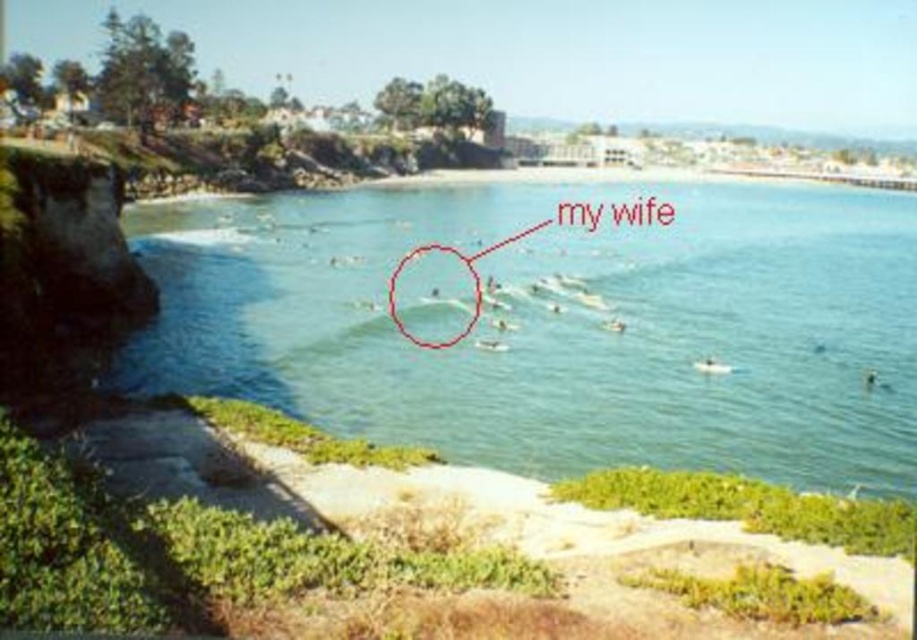
Question: Is clear blue water at center above smooth white surfboard at center?

Choices:
 (A) no
 (B) yes

Answer: (B)

Question: Does clear blue water at center appear on the right side of smooth white surfboard at center?

Choices:
 (A) yes
 (B) no

Answer: (A)

Question: Does clear blue water at center have a lesser width compared to smooth white surfboard at center?

Choices:
 (A) yes
 (B) no

Answer: (B)

Question: Which of the following is the closest to the observer?

Choices:
 (A) (823, 225)
 (B) (426, 243)

Answer: (B)

Question: Which point is closer to the camera?

Choices:
 (A) (868, 301)
 (B) (453, 339)

Answer: (B)